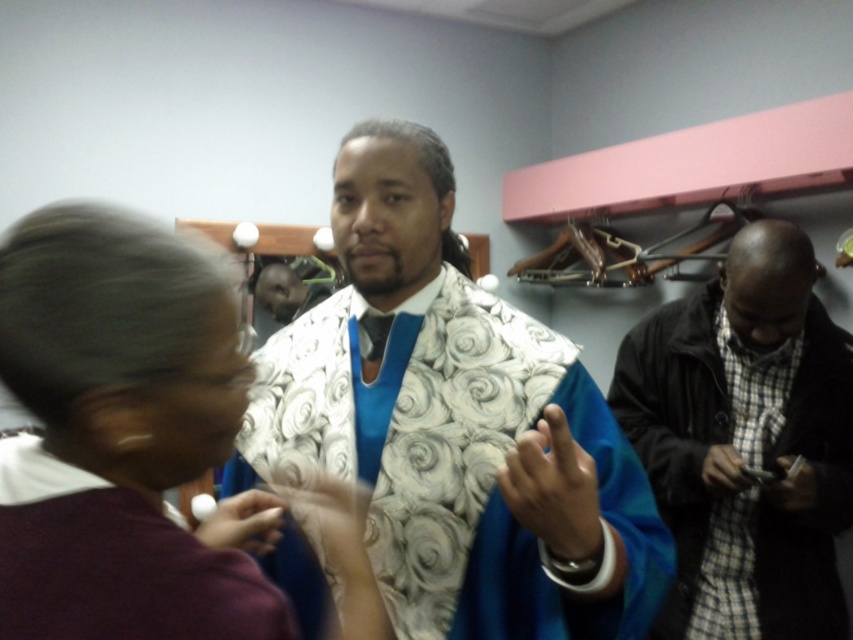
Can you confirm if matte floral robe at center is taller than purple fabric at center?

Yes, matte floral robe at center is taller than purple fabric at center.

Who is positioned more to the left, matte floral robe at center or purple fabric at center?

Positioned to the left is purple fabric at center.

What do you see at coordinates (454, 422) in the screenshot? I see `matte floral robe at center` at bounding box center [454, 422].

This screenshot has height=640, width=853. Find the location of `matte floral robe at center`. matte floral robe at center is located at coordinates (454, 422).

The height and width of the screenshot is (640, 853). Identify the location of matte floral robe at center. (454, 422).

Who is more forward, [485,580] or [680,566]?

Point [485,580] is more forward.

Image resolution: width=853 pixels, height=640 pixels. Describe the element at coordinates (454, 422) in the screenshot. I see `matte floral robe at center` at that location.

Where is `matte floral robe at center`? The width and height of the screenshot is (853, 640). matte floral robe at center is located at coordinates (454, 422).

Between point (608, 529) and point (112, 522), which one is positioned behind?

The point (608, 529) is behind.

Which is more to the left, matte floral robe at center or blue satin robe at center?

blue satin robe at center

Which is behind, point (480, 492) or point (12, 544)?

The point (480, 492) is more distant.

Find the location of `matte floral robe at center`. matte floral robe at center is located at coordinates [454, 422].